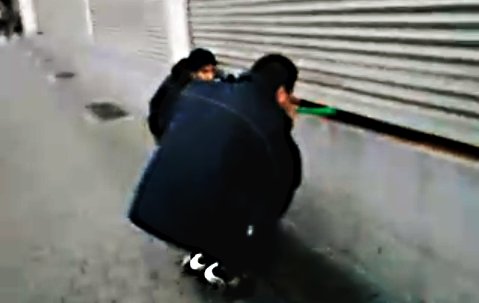
At what (x,y) coordinates should I click in order to perform the action: click on grate. Please return your answer as a coordinate pair (x, y). Image resolution: width=479 pixels, height=303 pixels. Looking at the image, I should click on (105, 114), (62, 72), (48, 61), (32, 52).